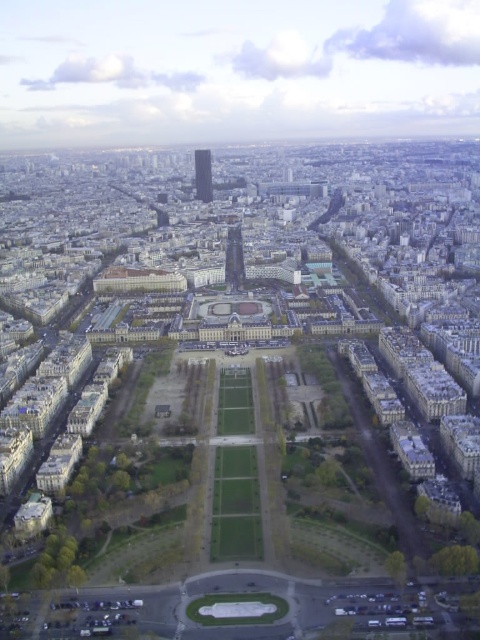
Between shiny metallic eiffel tower at center and smooth glass skyscraper at center, which one appears on the left side from the viewer's perspective?

From the viewer's perspective, smooth glass skyscraper at center appears more on the left side.

Which is behind, point (242, 284) or point (211, 184)?

Point (211, 184)

Where is `shiny metallic eiffel tower at center`? Image resolution: width=480 pixels, height=640 pixels. shiny metallic eiffel tower at center is located at coordinates (235, 257).

Where is `shiny metallic eiffel tower at center`? This screenshot has height=640, width=480. shiny metallic eiffel tower at center is located at coordinates (235, 257).